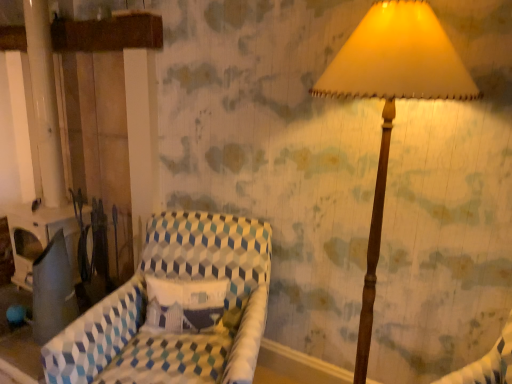
What do you see at coordinates (165, 318) in the screenshot? I see `patterned fabric chair at center` at bounding box center [165, 318].

Measure the distance between patterned fabric chair at center and camera.

They are 4.61 feet apart.

Measure the distance between point (170, 347) and camera.

Point (170, 347) and camera are 5.59 feet apart from each other.

Where is `patterned fabric chair at center`? patterned fabric chair at center is located at coordinates (165, 318).

Measure the distance between point (x=408, y=33) and camera.

They are 4.02 feet apart.

I want to click on wooden lampshade at upper right, so click(392, 101).

Describe the element at coordinates (392, 101) in the screenshot. I see `wooden lampshade at upper right` at that location.

The image size is (512, 384). I want to click on patterned fabric chair at center, so click(x=165, y=318).

Between patterned fabric chair at center and wooden lampshade at upper right, which one appears on the left side from the viewer's perspective?

Positioned to the left is patterned fabric chair at center.

Who is more distant, patterned fabric chair at center or wooden lampshade at upper right?

patterned fabric chair at center is more distant.

Which is in front, point (238, 347) or point (377, 56)?

Point (377, 56)

From the image's perspective, is patterned fabric chair at center on wooden lampshade at upper right?

No, from the image's perspective, patterned fabric chair at center is not over wooden lampshade at upper right.

In the scene shown: From a real-world perspective, between patterned fabric chair at center and wooden lampshade at upper right, who is vertically lower?

In real-world perspective, patterned fabric chair at center is lower.

In terms of width, does patterned fabric chair at center look wider or thinner when compared to wooden lampshade at upper right?

Clearly, patterned fabric chair at center has more width compared to wooden lampshade at upper right.

In terms of height, does patterned fabric chair at center look taller or shorter compared to wooden lampshade at upper right?

patterned fabric chair at center is shorter than wooden lampshade at upper right.

Is patterned fabric chair at center smaller than wooden lampshade at upper right?

Actually, patterned fabric chair at center might be larger than wooden lampshade at upper right.

Is wooden lampshade at upper right located within patterned fabric chair at center?

Actually, wooden lampshade at upper right is outside patterned fabric chair at center.

Is patterned fabric chair at center in contact with wooden lampshade at upper right?

No, patterned fabric chair at center is not next to wooden lampshade at upper right.

Is patterned fabric chair at center oriented towards wooden lampshade at upper right?

No.

Measure the distance between patterned fabric chair at center and wooden lampshade at upper right.

They are 78.74 centimeters apart.

The width and height of the screenshot is (512, 384). I want to click on furniture lying behind the wooden lampshade at upper right, so click(x=165, y=318).

Based on their positions, is wooden lampshade at upper right located to the left or right of patterned fabric chair at center?

wooden lampshade at upper right is positioned on patterned fabric chair at center's right side.

Is wooden lampshade at upper right further to camera compared to patterned fabric chair at center?

That is False.

Does point (450, 87) come in front of point (264, 237)?

Yes.

From the image's perspective, is wooden lampshade at upper right positioned above or below patterned fabric chair at center?

wooden lampshade at upper right is above patterned fabric chair at center.

From a real-world perspective, does wooden lampshade at upper right stand above patterned fabric chair at center?

Yes, from a real-world perspective, wooden lampshade at upper right is above patterned fabric chair at center.

Can you confirm if wooden lampshade at upper right is thinner than patterned fabric chair at center?

Indeed, wooden lampshade at upper right has a lesser width compared to patterned fabric chair at center.

Between wooden lampshade at upper right and patterned fabric chair at center, which one has more height?

Standing taller between the two is wooden lampshade at upper right.

Considering the sizes of wooden lampshade at upper right and patterned fabric chair at center in the image, is wooden lampshade at upper right bigger or smaller than patterned fabric chair at center?

Considering their sizes, wooden lampshade at upper right takes up less space than patterned fabric chair at center.

Can we say wooden lampshade at upper right lies outside patterned fabric chair at center?

Yes, wooden lampshade at upper right is outside of patterned fabric chair at center.

Is wooden lampshade at upper right beside patterned fabric chair at center?

There is a gap between wooden lampshade at upper right and patterned fabric chair at center.

Could you tell me if wooden lampshade at upper right is turned towards patterned fabric chair at center?

No, wooden lampshade at upper right is not oriented towards patterned fabric chair at center.

In the image, there is a wooden lampshade at upper right. Where is `furniture below it (from a real-world perspective)`? The height and width of the screenshot is (384, 512). furniture below it (from a real-world perspective) is located at coordinates point(165,318).

What are the coordinates of `lamp lying in front of the patterned fabric chair at center` in the screenshot? It's located at (392, 101).

In the image, there is a wooden lampshade at upper right. Where is `furniture below it (from the image's perspective)`? furniture below it (from the image's perspective) is located at coordinates (165, 318).